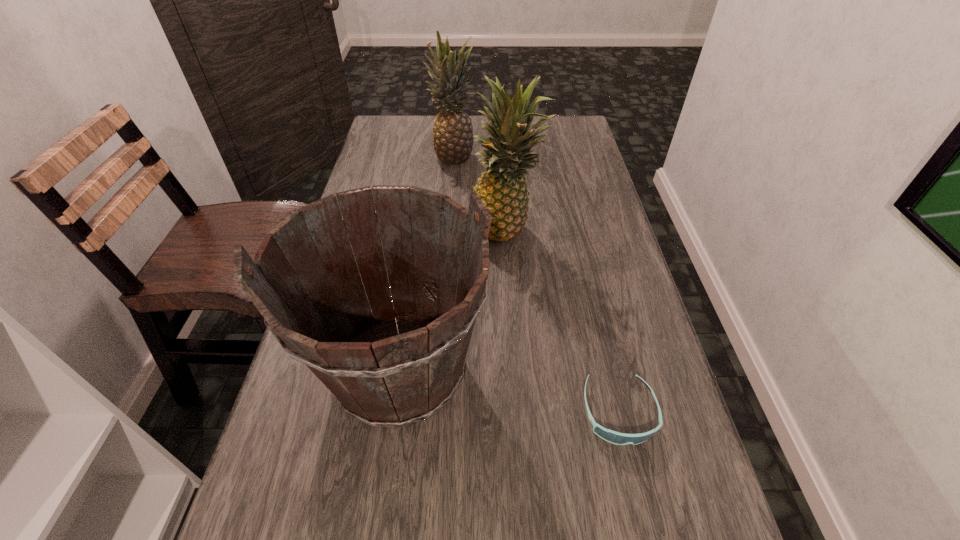
Locate an element on the screen. The width and height of the screenshot is (960, 540). the nearer pineapple is located at coordinates (502, 188).

Find the location of a particular element. Image resolution: width=960 pixels, height=540 pixels. the farther pineapple is located at coordinates (453, 140).

The width and height of the screenshot is (960, 540). In order to click on bucket in this screenshot , I will do `click(394, 367)`.

Locate an element on the screen. Lego is located at coordinates (342, 217).

At what (x,y) coordinates should I click in order to perform the action: click on goggles. Please return your answer as a coordinate pair (x, y). Image resolution: width=960 pixels, height=540 pixels. Looking at the image, I should click on (611, 436).

The width and height of the screenshot is (960, 540). What are the coordinates of `the rightmost object` in the screenshot? It's located at (611, 436).

Identify the location of vacant space located on the front of the nearer pineapple. (516, 390).

Where is `vacant region located on the right of the farthest object`? Image resolution: width=960 pixels, height=540 pixels. vacant region located on the right of the farthest object is located at coordinates (563, 157).

The width and height of the screenshot is (960, 540). In order to click on vacant area situated on the right of the bucket in this screenshot , I will do `click(560, 371)`.

The image size is (960, 540). What are the coordinates of `free space located on the face of the Lego` in the screenshot? It's located at (347, 252).